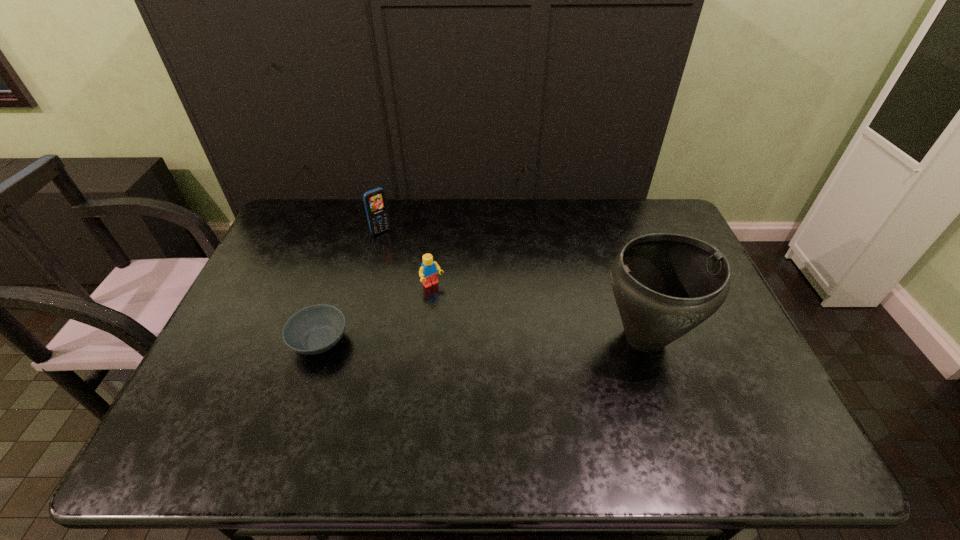
Locate an element on the screen. The width and height of the screenshot is (960, 540). vacant area situated 0.400m on the screen of the second tallest object is located at coordinates (450, 306).

Image resolution: width=960 pixels, height=540 pixels. Identify the location of vacant space located 0.290m on the screen of the second tallest object. (430, 284).

Find the location of `free space located 0.090m on the front-facing side of the third object from left to right`. free space located 0.090m on the front-facing side of the third object from left to right is located at coordinates (454, 310).

Identify the location of free space located 0.230m on the front-facing side of the third object from left to right. This screenshot has height=540, width=960. (481, 343).

Locate an element on the screen. Image resolution: width=960 pixels, height=540 pixels. vacant space located 0.230m on the front-facing side of the third object from left to right is located at coordinates (481, 343).

Locate an element on the screen. The width and height of the screenshot is (960, 540). object at the far edge is located at coordinates (375, 203).

You are a GUI agent. You are given a task and a screenshot of the screen. Output one action in this format:
    pyautogui.click(x=<x>, y=<y>)
    Task: Click on the object that is at the right edge
    
    Given the screenshot: What is the action you would take?
    pyautogui.click(x=665, y=285)

Locate an element on the screen. This screenshot has width=960, height=540. vacant area at the far edge is located at coordinates (480, 201).

This screenshot has width=960, height=540. Identify the location of free region at the near edge. (485, 402).

At what (x,y) coordinates should I click in order to perform the action: click on vacant space at the right edge. Please return your answer as a coordinate pair (x, y). The width and height of the screenshot is (960, 540). Looking at the image, I should click on (755, 368).